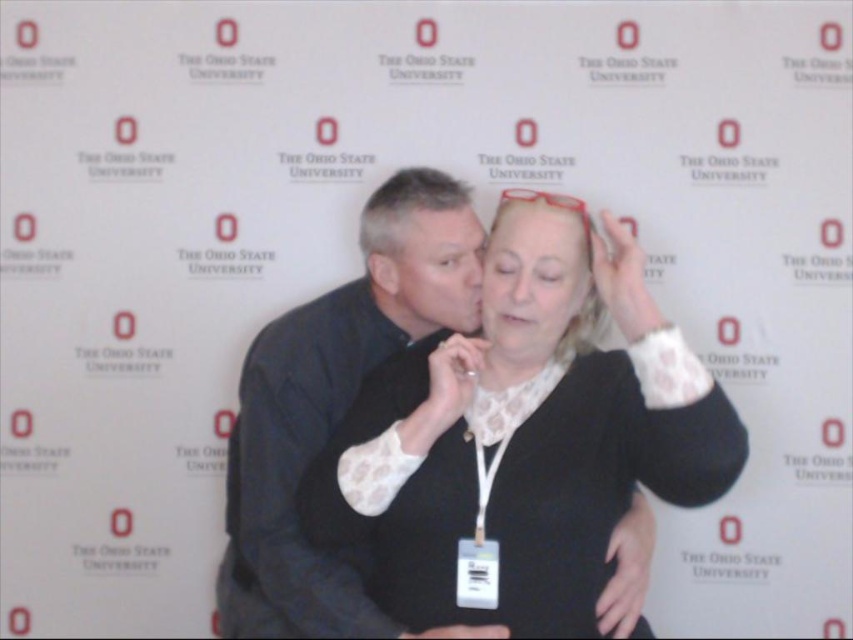
Question: Can you confirm if dark gray shirt at center is positioned below matte black forehead at center?

Choices:
 (A) yes
 (B) no

Answer: (A)

Question: In this image, where is matte black sweater at center located relative to dark gray shirt at center?

Choices:
 (A) right
 (B) left

Answer: (A)

Question: Estimate the real-world distances between objects in this image. Which object is farther from the matte black forehead at center?

Choices:
 (A) translucent plastic forehead at upper center
 (B) matte black sweater at center
 (C) dark gray shirt at center

Answer: (B)

Question: Does matte black sweater at center appear on the right side of matte black forehead at center?

Choices:
 (A) no
 (B) yes

Answer: (B)

Question: Estimate the real-world distances between objects in this image. Which object is closer to the matte black sweater at center?

Choices:
 (A) dark gray shirt at center
 (B) translucent plastic forehead at upper center
 (C) smooth skin face at center

Answer: (C)

Question: Which object appears farthest from the camera in this image?

Choices:
 (A) translucent plastic forehead at upper center
 (B) matte black sweater at center
 (C) smooth skin face at center
 (D) dark gray shirt at center

Answer: (A)